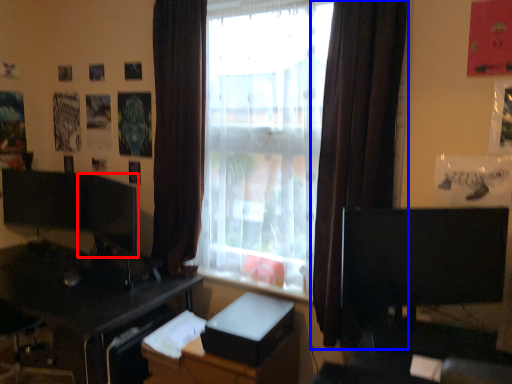
Question: Which point is further to the camera, computer monitor (highlighted by a red box) or curtain (highlighted by a blue box)?

Choices:
 (A) computer monitor
 (B) curtain

Answer: (A)